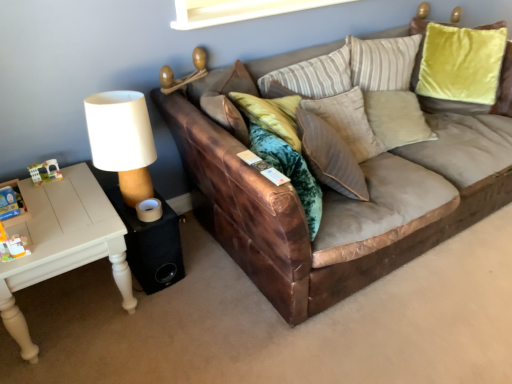
Question: Considering the relative positions of brown leather couch at center and white painted wood table at left in the image provided, is brown leather couch at center to the left of white painted wood table at left from the viewer's perspective?

Choices:
 (A) no
 (B) yes

Answer: (A)

Question: Can you confirm if brown leather couch at center is wider than white painted wood table at left?

Choices:
 (A) no
 (B) yes

Answer: (B)

Question: From the image's perspective, would you say brown leather couch at center is positioned over white painted wood table at left?

Choices:
 (A) no
 (B) yes

Answer: (B)

Question: Considering the relative sizes of brown leather couch at center and white painted wood table at left in the image provided, is brown leather couch at center shorter than white painted wood table at left?

Choices:
 (A) yes
 (B) no

Answer: (B)

Question: Is brown leather couch at center further to the viewer compared to white painted wood table at left?

Choices:
 (A) yes
 (B) no

Answer: (B)

Question: In terms of width, does suede-like beige pillow at center look wider or thinner when compared to white painted wood table at left?

Choices:
 (A) thin
 (B) wide

Answer: (A)

Question: Does point (338, 172) appear closer or farther from the camera than point (92, 175)?

Choices:
 (A) closer
 (B) farther

Answer: (A)

Question: Would you say suede-like beige pillow at center is to the left or to the right of white painted wood table at left in the picture?

Choices:
 (A) right
 (B) left

Answer: (A)

Question: In terms of size, does suede-like beige pillow at center appear bigger or smaller than white painted wood table at left?

Choices:
 (A) small
 (B) big

Answer: (A)

Question: Is white painted wood table at left taller or shorter than black fabric speaker at lower left?

Choices:
 (A) short
 (B) tall

Answer: (B)

Question: Is point (99, 185) closer or farther from the camera than point (148, 258)?

Choices:
 (A) farther
 (B) closer

Answer: (B)

Question: From the image's perspective, is white painted wood table at left above or below black fabric speaker at lower left?

Choices:
 (A) below
 (B) above

Answer: (A)

Question: Would you say white painted wood table at left is to the left or to the right of black fabric speaker at lower left in the picture?

Choices:
 (A) left
 (B) right

Answer: (A)

Question: Looking at the image, does black fabric speaker at lower left seem bigger or smaller compared to white painted wood table at left?

Choices:
 (A) small
 (B) big

Answer: (A)

Question: Considering the positions of black fabric speaker at lower left and white painted wood table at left in the image, is black fabric speaker at lower left taller or shorter than white painted wood table at left?

Choices:
 (A) short
 (B) tall

Answer: (A)